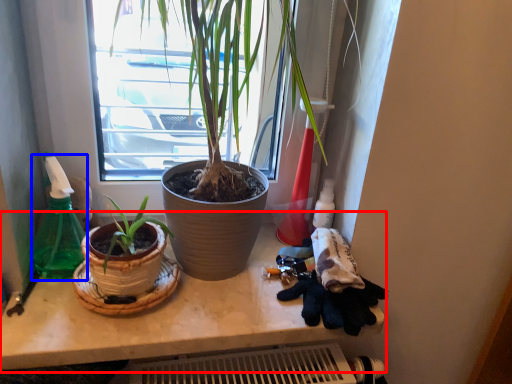
Question: Which object is closer to the camera taking this photo, counter (highlighted by a red box) or bottle (highlighted by a blue box)?

Choices:
 (A) counter
 (B) bottle

Answer: (A)